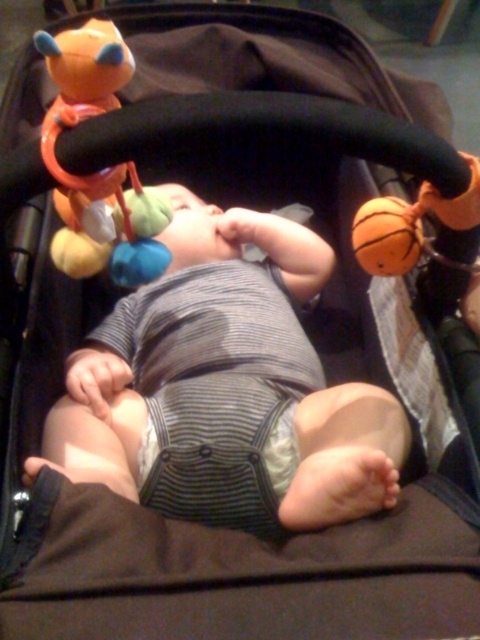
Is striped fabric baby at center above matte orange plush toy at upper left?

Actually, striped fabric baby at center is below matte orange plush toy at upper left.

Is point (213, 230) closer to camera compared to point (74, 124)?

No, (213, 230) is further to viewer.

Identify the location of striped fabric baby at center. (226, 388).